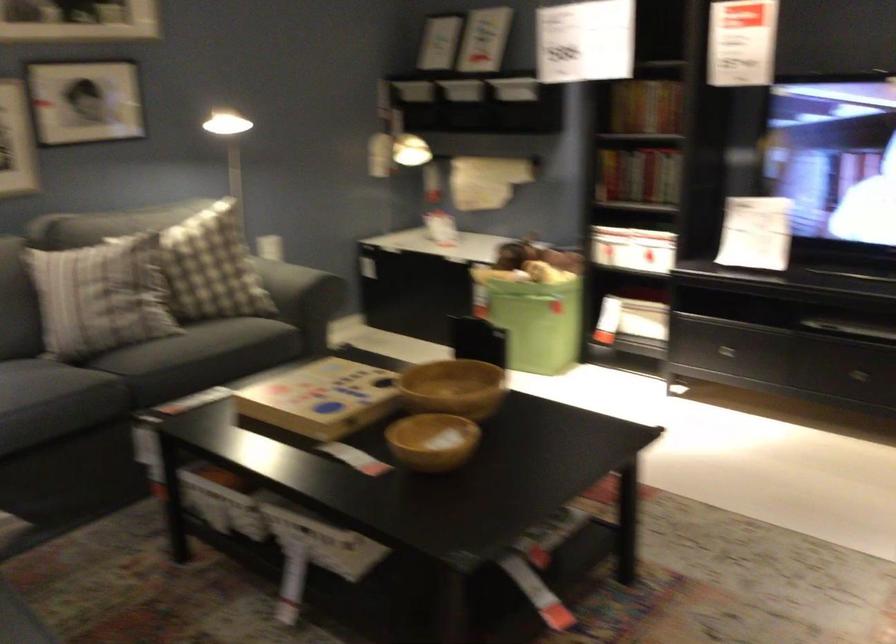
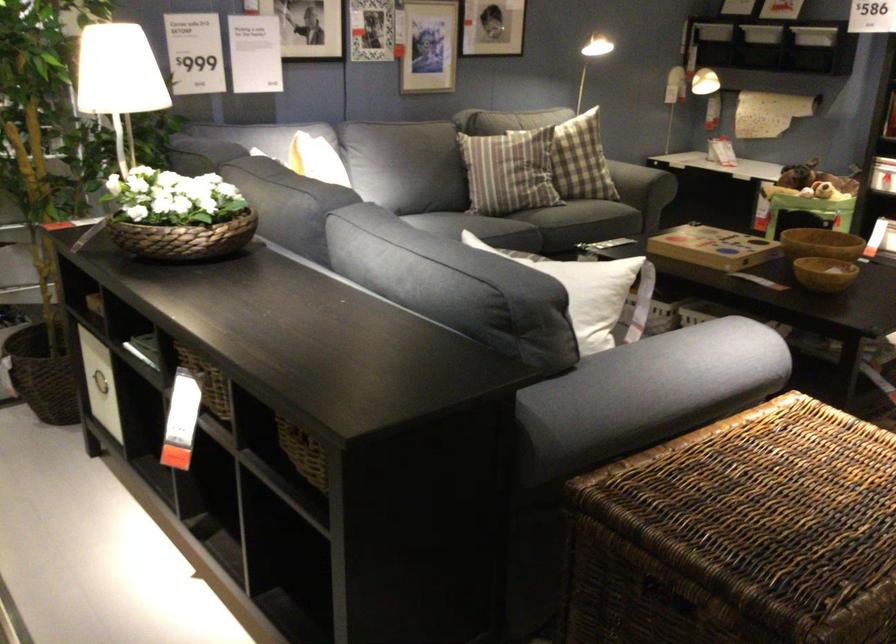
In the second image, find the point that corresponds to pixel 165 269 in the first image.

(581, 160)